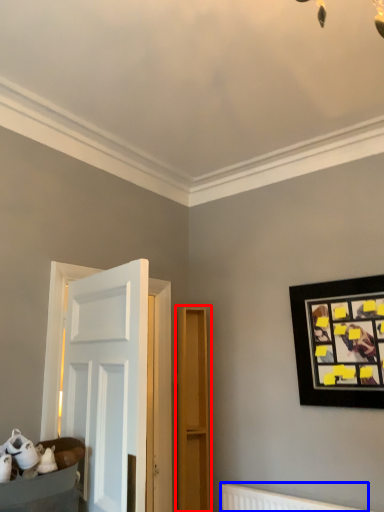
Question: Among these objects, which one is nearest to the camera, dresser (highlighted by a red box) or radiator (highlighted by a blue box)?

Choices:
 (A) dresser
 (B) radiator

Answer: (B)